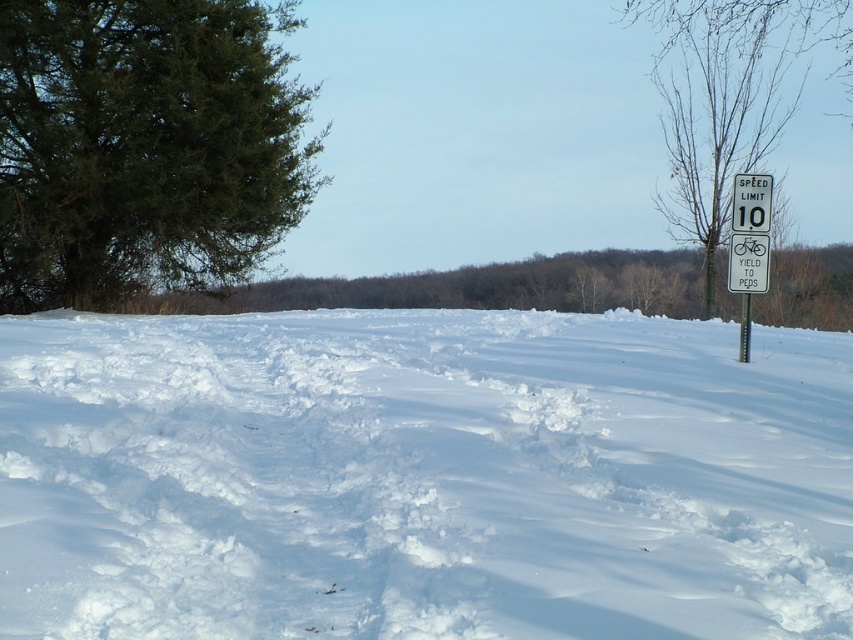
You are a painter setting up an easel to capture the snowy landscape. You want to ensure the bare wood tree at right and the white plastic speed limit sign at upper right are both visible in your painting. Based on their widths, which object should you position closer to the center to ensure it doesn,t get cut off by the edge?

The bare wood tree at right might be wider than the white plastic speed limit sign at upper right, so to prevent it from being cut off, position the bare wood tree at right closer to the center of the painting.

You are a delivery robot with a maximum range of 20 meters. You need to deliver a package from the green textured evergreen tree at left to the white plastic speed limit sign at upper right. Can you complete the delivery within your range?

The distance between the green textured evergreen tree at left and the white plastic speed limit sign at upper right is 16.76 meters, which is within your 20 meters range. Yes, you can complete the delivery.

You are driving a car and see the white plastic speed limit sign at upper right and the metallic silver pole at right. Which object is closer to you?

The white plastic speed limit sign at upper right is closer to you because it is in front of the metallic silver pole at right.